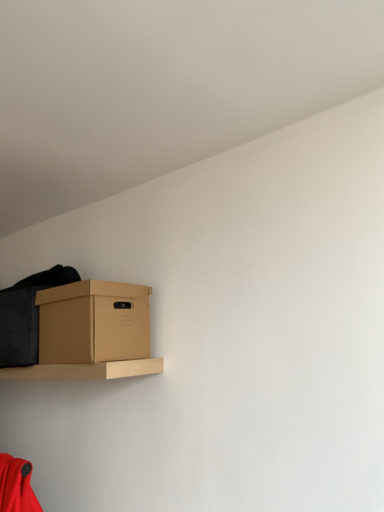
The height and width of the screenshot is (512, 384). I want to click on brown cardboard box at center, so click(93, 322).

What do you see at coordinates (93, 322) in the screenshot? The height and width of the screenshot is (512, 384). I see `brown cardboard box at center` at bounding box center [93, 322].

This screenshot has height=512, width=384. Identify the location of brown cardboard box at center. (93, 322).